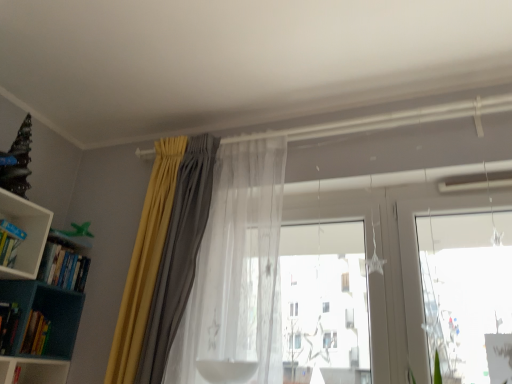
Question: From the image's perspective, is hardcover book at lower left, arranged as the 2th book when ordered from the bottom, on top of translucent sheer curtain at center, which is the 2th curtain from left to right?

Choices:
 (A) yes
 (B) no

Answer: (B)

Question: Is hardcover book at lower left, arranged as the 2th book when ordered from the bottom, to the left of translucent sheer curtain at center, which is the 2th curtain from left to right, from the viewer's perspective?

Choices:
 (A) no
 (B) yes

Answer: (B)

Question: From the image's perspective, is hardcover book at lower left, which is the 3th book in top-to-bottom order, beneath translucent sheer curtain at center, the first curtain positioned from the right?

Choices:
 (A) yes
 (B) no

Answer: (A)

Question: Is hardcover book at lower left, which is the 3th book in top-to-bottom order, outside translucent sheer curtain at center, which is the 2th curtain from left to right?

Choices:
 (A) yes
 (B) no

Answer: (A)

Question: Is hardcover book at lower left, arranged as the 2th book when ordered from the bottom, bigger than translucent sheer curtain at center, the first curtain positioned from the right?

Choices:
 (A) yes
 (B) no

Answer: (B)

Question: From the image's perspective, is translucent sheer curtain at center, the first curtain positioned from the right, located above or below yellow fabric curtain at upper left, which ranks as the first curtain in left-to-right order?

Choices:
 (A) above
 (B) below

Answer: (A)

Question: Is translucent sheer curtain at center, the first curtain positioned from the right, bigger or smaller than yellow fabric curtain at upper left, which ranks as the first curtain in left-to-right order?

Choices:
 (A) small
 (B) big

Answer: (B)

Question: Is point (182, 364) closer or farther from the camera than point (165, 354)?

Choices:
 (A) closer
 (B) farther

Answer: (B)

Question: Considering their positions, is translucent sheer curtain at center, the first curtain positioned from the right, located in front of or behind yellow fabric curtain at upper left, the second curtain viewed from the right?

Choices:
 (A) front
 (B) behind

Answer: (A)

Question: In the image, is yellow fabric curtain at upper left, which ranks as the first curtain in left-to-right order, on the left side or the right side of teal plastic bookcase at left?

Choices:
 (A) right
 (B) left

Answer: (A)

Question: Relative to teal plastic bookcase at left, is yellow fabric curtain at upper left, the second curtain viewed from the right, in front or behind?

Choices:
 (A) behind
 (B) front

Answer: (A)

Question: Considering the positions of yellow fabric curtain at upper left, the second curtain viewed from the right, and teal plastic bookcase at left in the image, is yellow fabric curtain at upper left, the second curtain viewed from the right, wider or thinner than teal plastic bookcase at left?

Choices:
 (A) wide
 (B) thin

Answer: (B)

Question: From a real-world perspective, relative to teal plastic bookcase at left, is yellow fabric curtain at upper left, the second curtain viewed from the right, vertically above or below?

Choices:
 (A) above
 (B) below

Answer: (A)

Question: Is point (30, 347) closer or farther from the camera than point (14, 243)?

Choices:
 (A) farther
 (B) closer

Answer: (A)

Question: From the image's perspective, relative to hardcover book at left, which is counted as the 1th book, starting from the top, is hardcover books at left, marked as the 4th book in a top-to-bottom arrangement, above or below?

Choices:
 (A) below
 (B) above

Answer: (A)